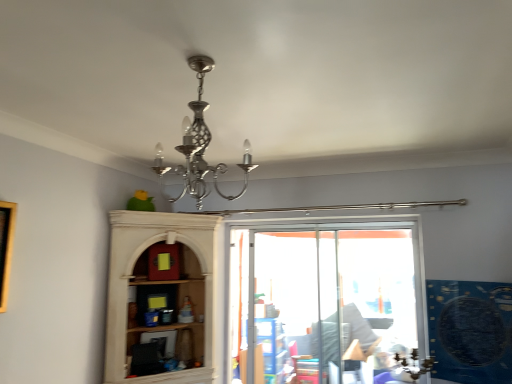
Question: Based on their sizes in the image, would you say polished silver chandelier at center is bigger or smaller than blue plastic shelf at center?

Choices:
 (A) small
 (B) big

Answer: (A)

Question: Is point 210,170 closer or farther from the camera than point 265,370?

Choices:
 (A) closer
 (B) farther

Answer: (A)

Question: Which of these objects is positioned closest to the polished silver chandelier at center?

Choices:
 (A) wooden picture frame at left
 (B) blue plastic shelf at center

Answer: (A)

Question: Based on their relative distances, which object is nearer to the wooden picture frame at left?

Choices:
 (A) blue plastic shelf at center
 (B) polished silver chandelier at center

Answer: (B)